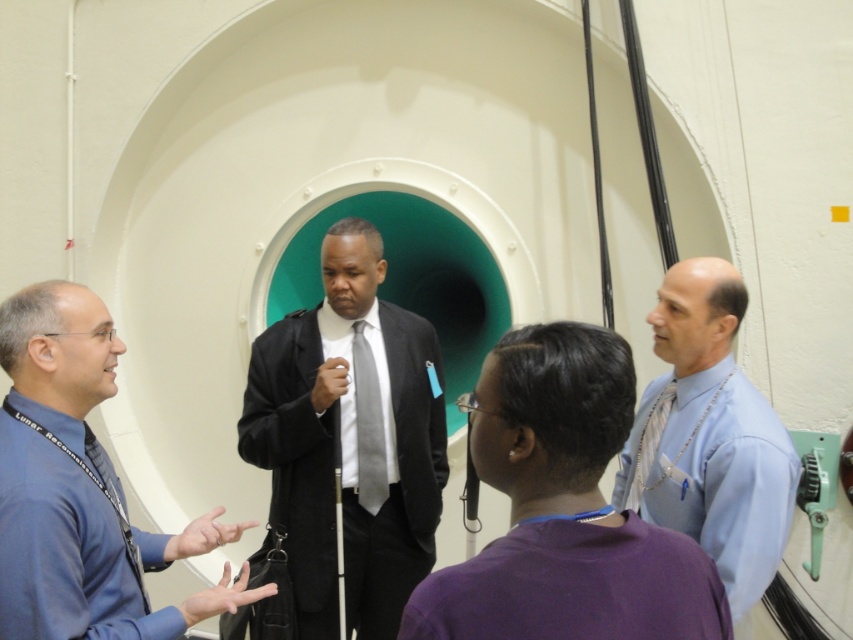
Is point (357, 392) farther from camera compared to point (662, 422)?

Yes, point (357, 392) is behind point (662, 422).

In the scene shown: Is gray satin tie at center further to the viewer compared to silver metallic tie at center?

Yes.

Is point (364, 506) less distant than point (657, 426)?

No, it is not.

The height and width of the screenshot is (640, 853). Find the location of `gray satin tie at center`. gray satin tie at center is located at coordinates 368,424.

Does light blue shirt at center have a larger size compared to gray satin tie at center?

Yes.

Between point (741, 474) and point (366, 348), which one is positioned behind?

Point (366, 348)

This screenshot has height=640, width=853. I want to click on light blue shirt at center, so click(709, 436).

Does matte black suit at center appear on the left side of light blue shirt at center?

Indeed, matte black suit at center is positioned on the left side of light blue shirt at center.

Which is behind, point (378, 272) or point (659, 384)?

Point (378, 272)

Where is `matte black suit at center`? The width and height of the screenshot is (853, 640). matte black suit at center is located at coordinates (349, 440).

You are a GUI agent. You are given a task and a screenshot of the screen. Output one action in this format:
    pyautogui.click(x=<x>, y=<y>)
    Task: Click on the matte black suit at center
    
    Given the screenshot: What is the action you would take?
    pyautogui.click(x=349, y=440)